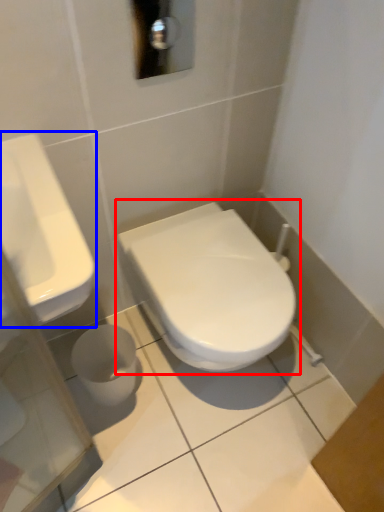
Question: Which point is closer to the camera, toilet (highlighted by a red box) or sink (highlighted by a blue box)?

Choices:
 (A) toilet
 (B) sink

Answer: (B)